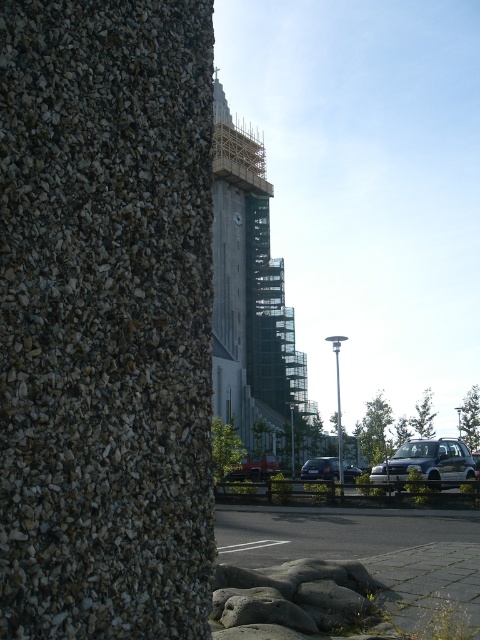
Question: Is rough textured stone at center wider than metallic red car at center?

Choices:
 (A) yes
 (B) no

Answer: (B)

Question: Which is nearer to the rough textured stone at center?

Choices:
 (A) concrete scaffolding at center
 (B) shiny silver sedan at center
 (C) smooth concrete wall at center

Answer: (C)

Question: Does rough textured stone at center appear under silver metallic hatchback at lower right?

Choices:
 (A) yes
 (B) no

Answer: (B)

Question: Which object is farther from the camera taking this photo?

Choices:
 (A) concrete scaffolding at center
 (B) smooth concrete wall at center

Answer: (A)

Question: Does shiny silver sedan at center have a lesser width compared to metallic red car at center?

Choices:
 (A) no
 (B) yes

Answer: (A)

Question: Which point is farther to the camera?

Choices:
 (A) (250, 216)
 (B) (317, 474)
 (C) (159, 262)

Answer: (A)